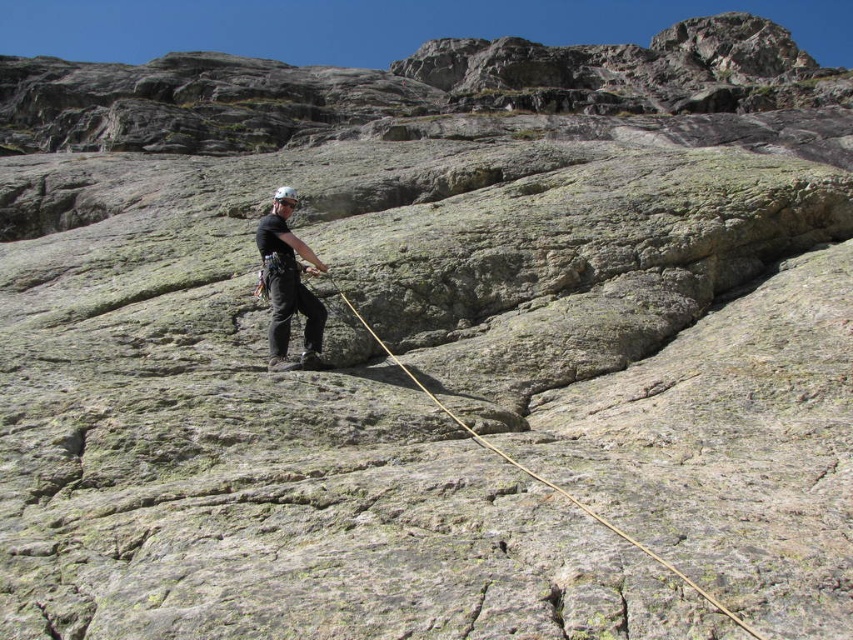
Question: Can you confirm if matte black helmet at center is smaller than brown rough rope at center?

Choices:
 (A) no
 (B) yes

Answer: (A)

Question: Is matte black helmet at center smaller than brown rough rope at center?

Choices:
 (A) yes
 (B) no

Answer: (B)

Question: Does matte black helmet at center come in front of brown rough rope at center?

Choices:
 (A) no
 (B) yes

Answer: (A)

Question: Which point is farther to the camera?

Choices:
 (A) (682, 577)
 (B) (293, 262)

Answer: (B)

Question: Which point is closer to the camera?

Choices:
 (A) matte black helmet at center
 (B) brown rough rope at center

Answer: (B)

Question: Among these objects, which one is farthest from the camera?

Choices:
 (A) matte black helmet at center
 (B) brown rough rope at center

Answer: (A)